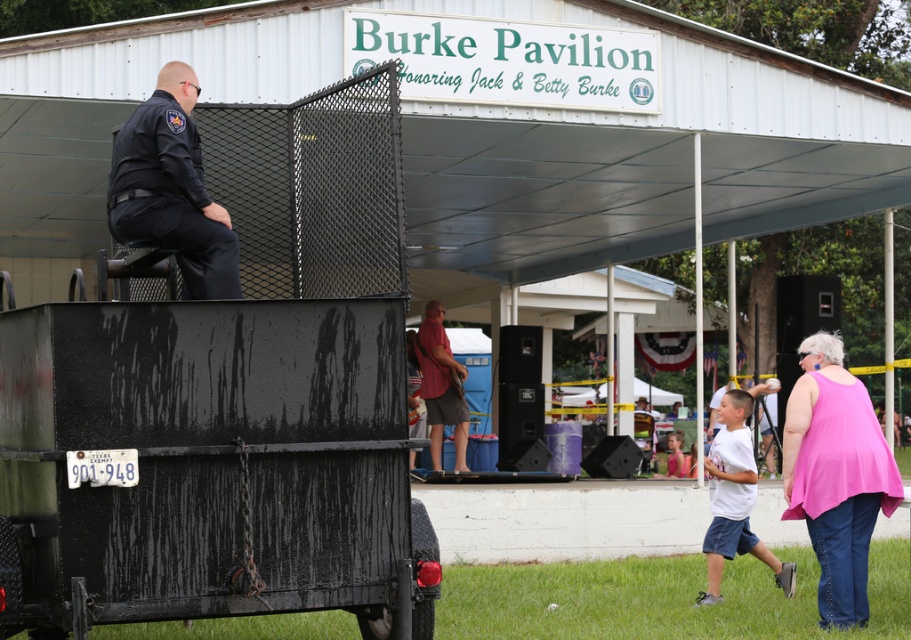
Question: Can you confirm if black matte trailer at upper left is positioned to the left of red fabric shirt at center?

Choices:
 (A) no
 (B) yes

Answer: (B)

Question: Which point appears farthest from the camera in this image?

Choices:
 (A) (742, 456)
 (B) (452, 387)
 (C) (674, 456)

Answer: (C)

Question: Can you confirm if white matte t-shirt at lower right is positioned to the right of white cotton shirt at center?

Choices:
 (A) yes
 (B) no

Answer: (B)

Question: Which is nearer to the white cotton shirt at center?

Choices:
 (A) red fabric shirt at center
 (B) white matte t-shirt at lower right

Answer: (A)

Question: Which point is closer to the camera?

Choices:
 (A) (732, 518)
 (B) (873, 490)
 (C) (156, 150)

Answer: (C)

Question: From the image, what is the correct spatial relationship of white matte shirt at lower right in relation to red fabric shirt at center?

Choices:
 (A) left
 (B) right

Answer: (B)